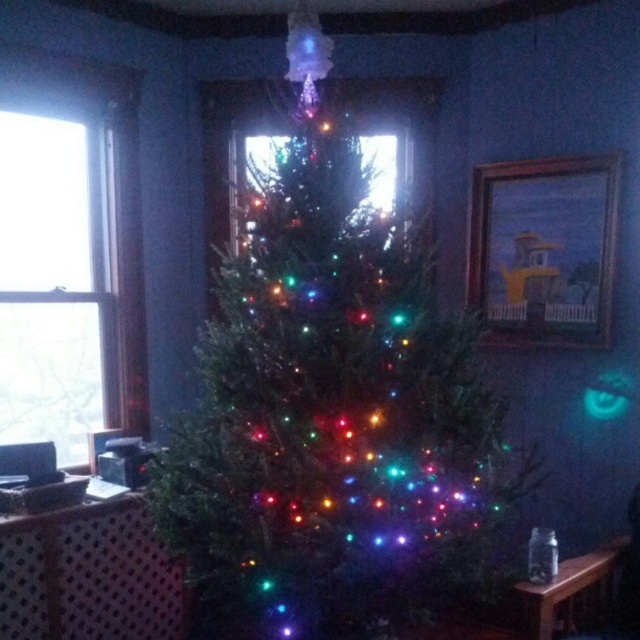
You are standing in the room and want to take a photo of the iridescent plastic christmas tree at center without the transparent glass window at left appearing in the background. Is this possible given their positions?

The iridescent plastic christmas tree at center is in front of the transparent glass window at left, so you can take a photo of the iridescent plastic christmas tree at center without the transparent glass window at left in the background by positioning yourself so the tree blocks the window from view.

You are standing in the room with the Christmas tree. There is a point at coordinates (332, 406). What object is located at that point?

The point at coordinates (332, 406) is where the iridescent plastic Christmas tree at center is located.

You are standing in the room and want to place a new decoration at the exact center of the room. The iridescent plastic christmas tree at center is currently located at point 0.637, 0.520. Is the tree positioned exactly at the center of the room?

The iridescent plastic christmas tree at center is located at point (332, 406), which is not exactly at the center of the room since the true center would be at (320, 320).